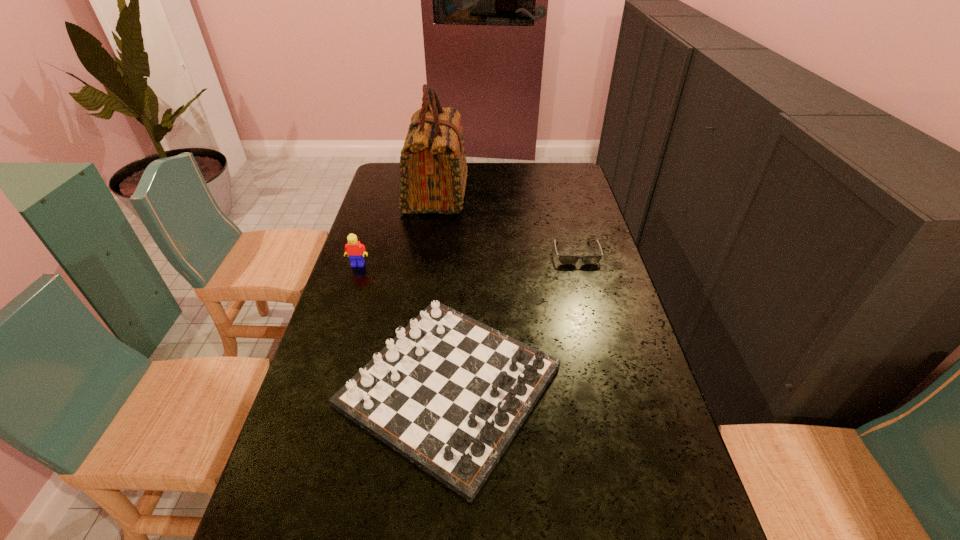
This screenshot has width=960, height=540. I want to click on vacant space located on the back of the second shortest object, so click(x=459, y=234).

You are a GUI agent. You are given a task and a screenshot of the screen. Output one action in this format:
    pyautogui.click(x=<x>, y=<y>)
    Task: Click on the vacant space located 0.230m on the front-facing side of the shortest object
    The width and height of the screenshot is (960, 540).
    Given the screenshot: What is the action you would take?
    pyautogui.click(x=593, y=316)

Locate an element on the screen. The width and height of the screenshot is (960, 540). object that is at the far edge is located at coordinates (433, 172).

Find the location of a particular element. shopping bag located in the left edge section of the desktop is located at coordinates (433, 172).

Find the location of a particular element. This screenshot has width=960, height=540. Lego that is at the left edge is located at coordinates (354, 249).

Image resolution: width=960 pixels, height=540 pixels. In order to click on chessboard that is at the left edge in this screenshot , I will do `click(449, 393)`.

Identify the location of object located in the right edge section of the desktop. (564, 259).

At what (x,y) coordinates should I click in order to perform the action: click on object that is positioned at the far left corner. Please return your answer as a coordinate pair (x, y). The height and width of the screenshot is (540, 960). Looking at the image, I should click on (433, 172).

The image size is (960, 540). In the image, there is a desktop. What are the coordinates of `vacant space at the far edge` in the screenshot? It's located at (491, 164).

In the image, there is a desktop. What are the coordinates of `vacant space at the left edge` in the screenshot? It's located at (375, 337).